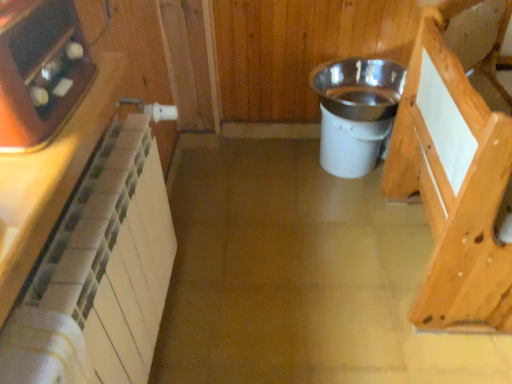
Locate an element on the screen. vacant space situated above white plastic bucket at center, the second appliance in the left-to-right sequence (from a real-world perspective) is located at coordinates (359, 108).